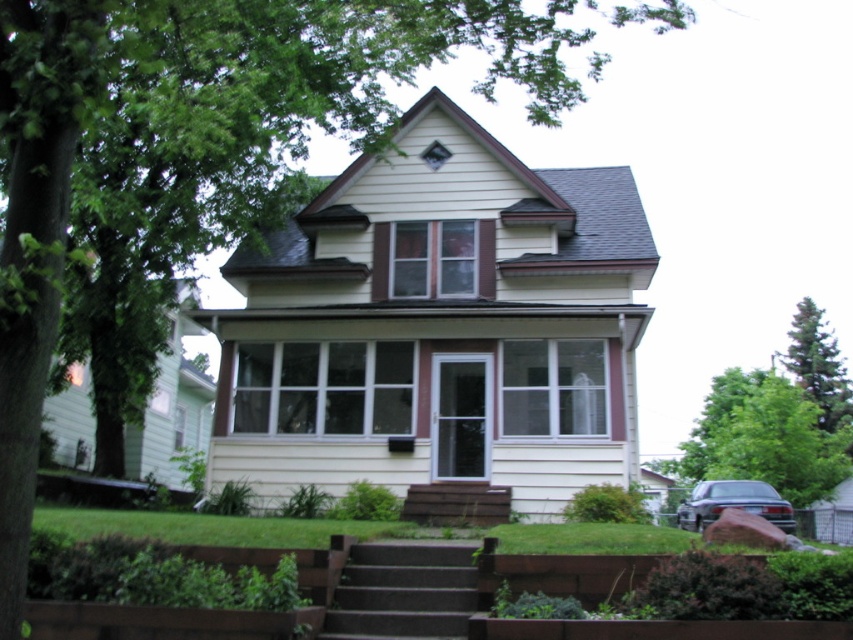
You are a delivery person trying to park your van in the driveway next to the brown wooden stairs at center. The van is 2 meters wide. Can you park there without hitting the green leafy tree at right?

The green leafy tree at right is wider than the brown wooden stairs at center. Since the van is 2 meters wide, you need to ensure there is enough space between the stairs and the tree. However, since the tree is wider, the available space might be insufficient. It is safer to park elsewhere to avoid damaging the tree or the van.

You are standing in front of the house and want to walk to the green leafy tree at right from the brown wooden stairs at center. Which direction should you head?

The green leafy tree at right is to the right of the brown wooden stairs at center, so you should head to the right to reach it.